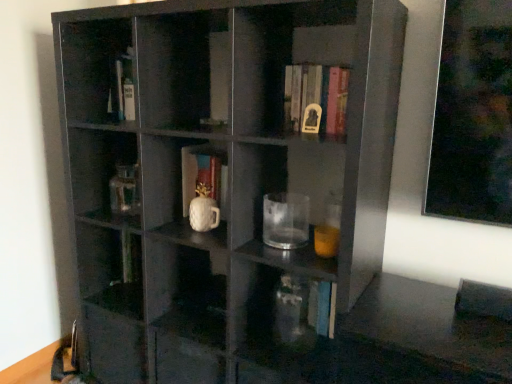
The height and width of the screenshot is (384, 512). What do you see at coordinates (227, 181) in the screenshot? I see `matte black shelf at center` at bounding box center [227, 181].

This screenshot has height=384, width=512. What do you see at coordinates (285, 220) in the screenshot?
I see `transparent glass mug at center` at bounding box center [285, 220].

This screenshot has height=384, width=512. Describe the element at coordinates (316, 98) in the screenshot. I see `hardcover book at upper center, which appears as the 2th book when ordered from the bottom` at that location.

You are a GUI agent. You are given a task and a screenshot of the screen. Output one action in this format:
    pyautogui.click(x=<x>, y=<y>)
    Task: Click on the matte black shelf at center
    
    Given the screenshot: What is the action you would take?
    pyautogui.click(x=227, y=181)

Find the location of a particular element. Image resolution: width=512 pixels, height=384 pixels. mug below the white glossy mug at center, the 2th book positioned from the right (from the image's perspective) is located at coordinates (285, 220).

From the image's perspective, is transparent glass mug at center located above or below white glossy mug at center, the second book in the top-to-bottom sequence?

Clearly, from the image's perspective, transparent glass mug at center is below white glossy mug at center, the second book in the top-to-bottom sequence.

From the picture: Relative to white glossy mug at center, the 2th book positioned from the right, is transparent glass mug at center in front or behind?

In the image, transparent glass mug at center appears in front of white glossy mug at center, the 2th book positioned from the right.

Who is shorter, transparent glass mug at center or white glossy mug at center, which is the first book from left to right?

With less height is transparent glass mug at center.

Is white glossy mug at center, the second book in the top-to-bottom sequence, positioned beyond the bounds of transparent glass vase at lower center?

Yes, white glossy mug at center, the second book in the top-to-bottom sequence, is not within transparent glass vase at lower center.

From a real-world perspective, is white glossy mug at center, the first book when ordered from back to front, above or below transparent glass vase at lower center?

From a real-world perspective, white glossy mug at center, the first book when ordered from back to front, is physically above transparent glass vase at lower center.

Can you see white glossy mug at center, which is the second book in front-to-back order, touching transparent glass vase at lower center?

No, white glossy mug at center, which is the second book in front-to-back order, is not with transparent glass vase at lower center.

From a real-world perspective, between transparent glass mug at center and transparent glass vase at lower center, who is vertically higher?

From a 3D spatial view, transparent glass mug at center is above.

Which point is more forward, [279,246] or [312,299]?

Point [279,246]

Considering the sizes of transparent glass mug at center and transparent glass vase at lower center in the image, is transparent glass mug at center bigger or smaller than transparent glass vase at lower center?

In the image, transparent glass mug at center appears to be smaller than transparent glass vase at lower center.

Is hardcover book at upper center, which is counted as the second book, starting from the left, facing away from matte black shelf at center?

Yes, hardcover book at upper center, which is counted as the second book, starting from the left,'s orientation is away from matte black shelf at center.

Would you say hardcover book at upper center, which is the first book from right to left, is outside matte black shelf at center?

No, hardcover book at upper center, which is the first book from right to left, is inside matte black shelf at center's boundary.

Is hardcover book at upper center, placed as the first book when sorted from front to back, with matte black shelf at center?

They are not placed beside each other.

Which point is more forward, (340, 117) or (186, 377)?

The point (340, 117) is in front.

The width and height of the screenshot is (512, 384). Identify the location of shelf that appears in front of the transparent glass mug at center. (227, 181).

Between transparent glass mug at center and matte black shelf at center, which one has smaller width?

With smaller width is transparent glass mug at center.

Does point (289, 210) appear closer or farther from the camera than point (194, 16)?

Clearly, point (289, 210) is closer to the camera than point (194, 16).

Is transparent glass mug at center behind matte black shelf at center?

Yes, transparent glass mug at center is behind matte black shelf at center.

Considering the relative sizes of transparent glass mug at center and hardcover book at upper center, placed as the first book when sorted from front to back, in the image provided, is transparent glass mug at center bigger than hardcover book at upper center, placed as the first book when sorted from front to back,?

No.

In the image, is transparent glass mug at center positioned in front of or behind hardcover book at upper center, which is counted as the second book, starting from the left?

transparent glass mug at center is in front of hardcover book at upper center, which is counted as the second book, starting from the left.

Is transparent glass mug at center looking in the opposite direction of hardcover book at upper center, which is counted as the second book, starting from the left?

No.

In terms of width, does matte black shelf at center look wider or thinner when compared to white glossy mug at center, the 1th book in the bottom-to-top sequence?

Considering their sizes, matte black shelf at center looks broader than white glossy mug at center, the 1th book in the bottom-to-top sequence.

Find the location of a particular element. This screenshot has height=384, width=512. book that is the 1st object located above the matte black shelf at center (from the image's perspective) is located at coordinates 204,174.

From the picture: Considering the relative sizes of matte black shelf at center and white glossy mug at center, which is the first book from left to right, in the image provided, is matte black shelf at center bigger than white glossy mug at center, which is the first book from left to right,?

Correct, matte black shelf at center is larger in size than white glossy mug at center, which is the first book from left to right.

Identify the location of book that is the 1st object located above the transparent glass mug at center (from the image's perspective). (204, 174).

This screenshot has height=384, width=512. What are the coordinates of `glass vase on the right side of white glossy mug at center, which is the second book in front-to-back order` in the screenshot? It's located at (296, 311).

Considering their positions, is matte black shelf at center positioned further to hardcover book at upper center, which is the first book from right to left, than white glossy mug at center, the second book in the top-to-bottom sequence?

matte black shelf at center.

Estimate the real-world distances between objects in this image. Which object is closer to transparent glass vase at lower center, white glossy mug at center, the first book when ordered from back to front, or hardcover book at upper center, which ranks as the 2th book in back-to-front order?

white glossy mug at center, the first book when ordered from back to front.

Considering their positions, is transparent glass mug at center positioned further to hardcover book at upper center, which appears as the 2th book when ordered from the bottom, than transparent glass vase at lower center?

transparent glass vase at lower center.

Considering their positions, is matte black shelf at center positioned closer to transparent glass vase at lower center than hardcover book at upper center, which is the first book from right to left?

matte black shelf at center is positioned closer to the anchor transparent glass vase at lower center.

From the image, which object appears to be nearer to transparent glass mug at center, matte black shelf at center or transparent glass vase at lower center?

Among the two, transparent glass vase at lower center is located nearer to transparent glass mug at center.

When comparing their distances from white glossy mug at center, which is the first book from left to right, does matte black shelf at center or transparent glass mug at center seem closer?

transparent glass mug at center is positioned closer to the anchor white glossy mug at center, which is the first book from left to right.

When comparing their distances from white glossy mug at center, which is the second book in front-to-back order, does hardcover book at upper center, which ranks as the first book in top-to-bottom order, or transparent glass mug at center seem closer?

transparent glass mug at center.

Which object lies further to the anchor point transparent glass mug at center, hardcover book at upper center, which ranks as the 2th book in back-to-front order, or matte black shelf at center?

matte black shelf at center.

Where is `shelf between hardcover book at upper center, placed as the first book when sorted from front to back, and transparent glass vase at lower center from top to bottom`? The width and height of the screenshot is (512, 384). shelf between hardcover book at upper center, placed as the first book when sorted from front to back, and transparent glass vase at lower center from top to bottom is located at coordinates (227, 181).

You are a GUI agent. You are given a task and a screenshot of the screen. Output one action in this format:
    pyautogui.click(x=<x>, y=<y>)
    Task: Click on the book between hardcover book at upper center, which ranks as the first book in top-to-bottom order, and transparent glass mug at center, in the vertical direction
    The image size is (512, 384).
    Given the screenshot: What is the action you would take?
    click(x=204, y=174)

The width and height of the screenshot is (512, 384). What are the coordinates of `book positioned between matte black shelf at center and white glossy mug at center, the first book when ordered from back to front, from near to far` in the screenshot? It's located at (316, 98).

Find the location of a particular element. mug between white glossy mug at center, which is the first book from left to right, and transparent glass vase at lower center in the up-down direction is located at coordinates (285, 220).